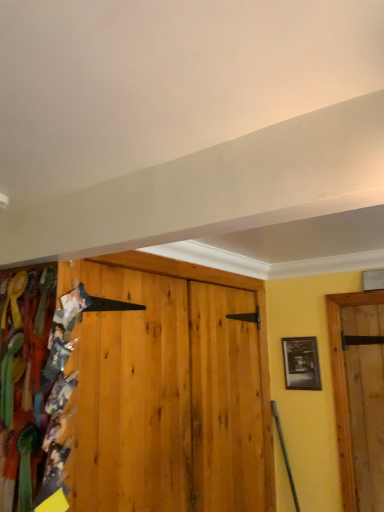
Locate an element on the screen. This screenshot has width=384, height=512. multicolored fabric at left is located at coordinates (27, 378).

What do you see at coordinates (27, 378) in the screenshot?
I see `multicolored fabric at left` at bounding box center [27, 378].

Find the location of `black glossy picture frame at right`. black glossy picture frame at right is located at coordinates (301, 362).

This screenshot has height=512, width=384. What do you see at coordinates (301, 362) in the screenshot? I see `black glossy picture frame at right` at bounding box center [301, 362].

At what (x,y) coordinates should I click in order to perform the action: click on multicolored fabric at left. Please return your answer as a coordinate pair (x, y). Looking at the image, I should click on (27, 378).

Is black glossy picture frame at right at the right side of multicolored fabric at left?

Indeed, black glossy picture frame at right is positioned on the right side of multicolored fabric at left.

From the picture: Is the depth of black glossy picture frame at right greater than that of multicolored fabric at left?

Yes, the depth of black glossy picture frame at right is greater than that of multicolored fabric at left.

Does point (319, 388) lie in front of point (69, 353)?

No, (319, 388) is behind (69, 353).

From the image's perspective, is black glossy picture frame at right located above multicolored fabric at left?

Incorrect, from the image's perspective, black glossy picture frame at right is lower than multicolored fabric at left.

From a real-world perspective, which object stands above the other?

black glossy picture frame at right.

Can you confirm if black glossy picture frame at right is wider than multicolored fabric at left?

No.

Based on the photo, is black glossy picture frame at right shorter than multicolored fabric at left?

Yes.

Looking at the image, does black glossy picture frame at right seem bigger or smaller compared to multicolored fabric at left?

Clearly, black glossy picture frame at right is smaller in size than multicolored fabric at left.

Choose the correct answer: Is black glossy picture frame at right inside multicolored fabric at left or outside it?

The correct answer is: outside.

Would you consider black glossy picture frame at right to be distant from multicolored fabric at left?

Yes.

Is black glossy picture frame at right aimed at multicolored fabric at left?

Yes, black glossy picture frame at right faces towards multicolored fabric at left.

The width and height of the screenshot is (384, 512). I want to click on textile that is in front of the black glossy picture frame at right, so click(x=27, y=378).

In the image, is multicolored fabric at left on the left side or the right side of black glossy picture frame at right?

From the image, it's evident that multicolored fabric at left is to the left of black glossy picture frame at right.

Does multicolored fabric at left lie behind black glossy picture frame at right?

No, multicolored fabric at left is closer to the camera.

Is point (12, 302) closer or farther from the camera than point (310, 380)?

Point (12, 302) appears to be closer to the viewer than point (310, 380).

From the image's perspective, relative to black glossy picture frame at right, is multicolored fabric at left above or below?

multicolored fabric at left is situated higher than black glossy picture frame at right in the image.

From a real-world perspective, is multicolored fabric at left physically above black glossy picture frame at right?

Incorrect, from a real-world perspective, multicolored fabric at left is lower than black glossy picture frame at right.

Considering the sizes of multicolored fabric at left and black glossy picture frame at right in the image, is multicolored fabric at left wider or thinner than black glossy picture frame at right?

In the image, multicolored fabric at left appears to be wider than black glossy picture frame at right.

Which of these two, multicolored fabric at left or black glossy picture frame at right, stands shorter?

black glossy picture frame at right.

Which of these two, multicolored fabric at left or black glossy picture frame at right, is bigger?

With larger size is multicolored fabric at left.

Would you say multicolored fabric at left contains black glossy picture frame at right?

Definitely not — black glossy picture frame at right is not inside multicolored fabric at left.

Are multicolored fabric at left and black glossy picture frame at right located far from each other?

multicolored fabric at left is far away from black glossy picture frame at right.

Consider the image. Is multicolored fabric at left turned away from black glossy picture frame at right?

That's not correct — multicolored fabric at left is not looking away from black glossy picture frame at right.

How different are the orientations of multicolored fabric at left and black glossy picture frame at right in degrees?

They differ by 88.9 degrees in their facing directions.

The height and width of the screenshot is (512, 384). Identify the location of textile lying above the black glossy picture frame at right (from the image's perspective). (27, 378).

Find the location of a particular element. The height and width of the screenshot is (512, 384). textile in front of the black glossy picture frame at right is located at coordinates (27, 378).

The height and width of the screenshot is (512, 384). In order to click on picture frame behind the multicolored fabric at left in this screenshot , I will do `click(301, 362)`.